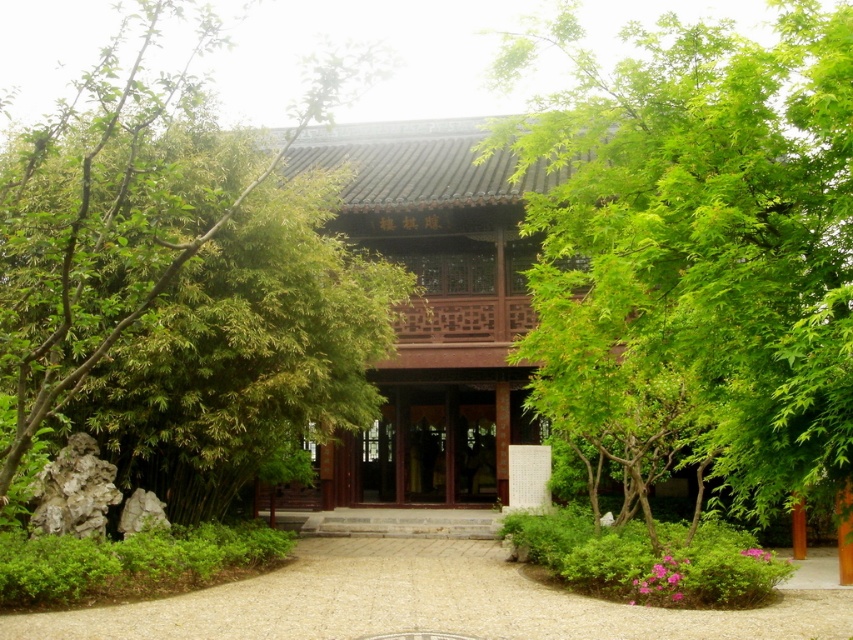
Question: Among these points, which one is farthest from the camera?

Choices:
 (A) (776, 419)
 (B) (386, 561)
 (C) (100, 108)
 (D) (618, 577)

Answer: (C)

Question: Where is green bamboo at left located in relation to smooth gravel path at center in the image?

Choices:
 (A) right
 (B) left

Answer: (B)

Question: Among these objects, which one is farthest from the camera?

Choices:
 (A) green leafy bush at lower center
 (B) brown wooden door at center

Answer: (B)

Question: Can you confirm if smooth gravel path at center is wider than green leafy bush at lower center?

Choices:
 (A) no
 (B) yes

Answer: (B)

Question: Is green leafy tree at center closer to camera compared to brown wooden door at center?

Choices:
 (A) yes
 (B) no

Answer: (A)

Question: Which point appears farthest from the camera in this image?

Choices:
 (A) (497, 637)
 (B) (316, 374)

Answer: (B)